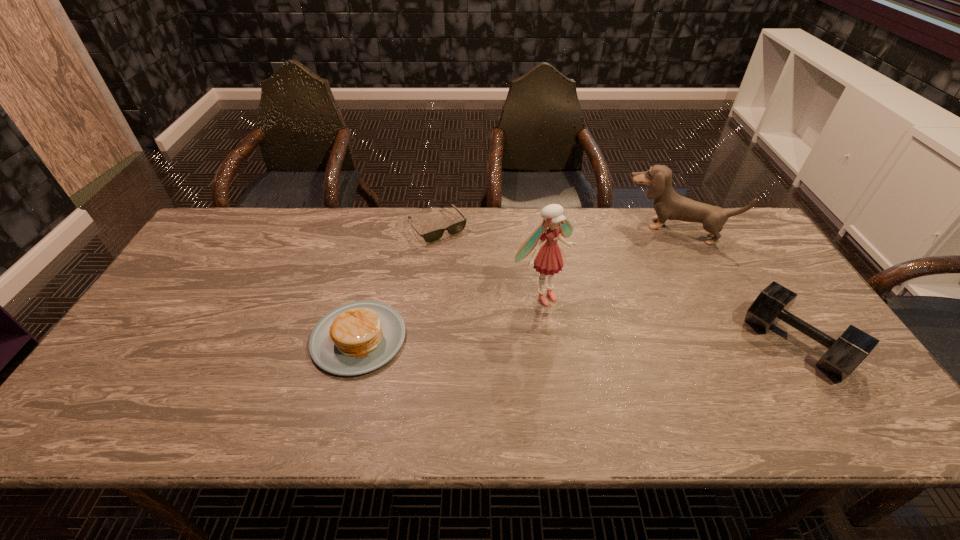
Find the location of `vacant space on the desktop that is between the fourth tallest object and the dumbbell and is positioned at the face of the puppy`. vacant space on the desktop that is between the fourth tallest object and the dumbbell and is positioned at the face of the puppy is located at coordinates (634, 341).

The width and height of the screenshot is (960, 540). What are the coordinates of `vacant spot on the desktop that is between the pancake and the third shortest object and is positioned on the front-facing side of the sunglasses` in the screenshot? It's located at (536, 340).

Identify the location of vacant spot on the desktop that is between the pancake and the third tallest object and is positioned on the front-facing side of the third object from left to right. (591, 341).